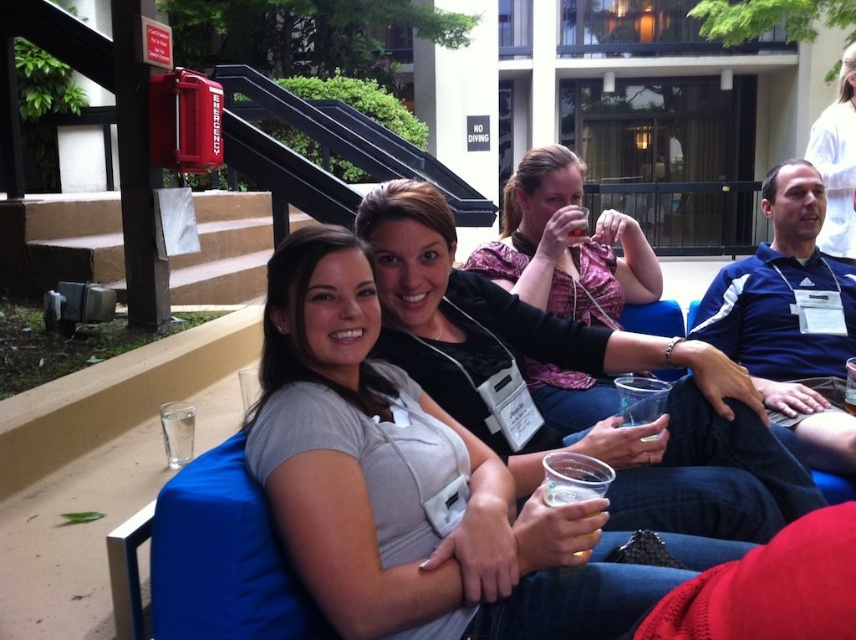
Does matte black jacket at center have a greater width compared to translucent plastic cup at lower center?

Yes.

This screenshot has width=856, height=640. Identify the location of matte black jacket at center. (581, 371).

Where is `matte black jacket at center`? matte black jacket at center is located at coordinates (581, 371).

Who is more distant from viewer, [753,420] or [527,275]?

The point [527,275] is more distant.

Is point (456, 376) closer to viewer compared to point (553, 145)?

That is True.

Does point (688, 451) come farther from viewer compared to point (531, 182)?

No, it is in front of (531, 182).

At what (x,y) coordinates should I click in order to perform the action: click on matte black jacket at center. Please return your answer as a coordinate pair (x, y). Looking at the image, I should click on (581, 371).

Who is more forward, (544, 179) or (597, 492)?

Positioned in front is point (597, 492).

I want to click on matte pink sweater at center, so click(565, 244).

The image size is (856, 640). What are the coordinates of `matte pink sweater at center` in the screenshot? It's located at (565, 244).